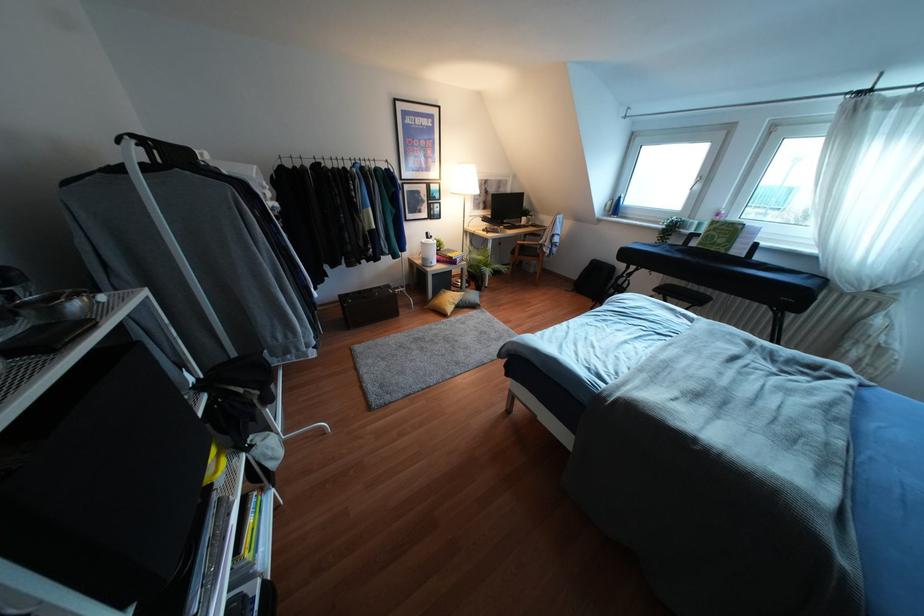
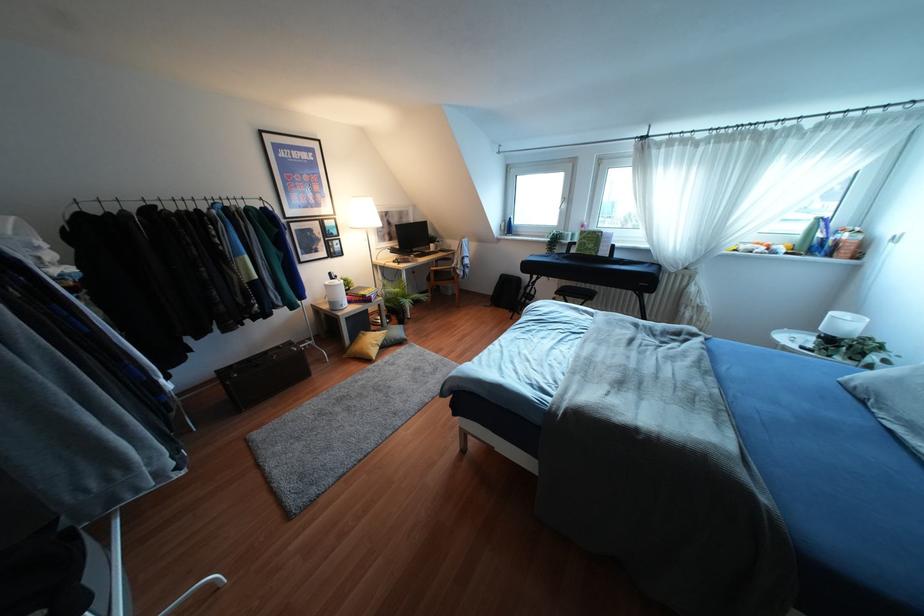
Question: The images are taken continuously from a first-person perspective. In which direction is your viewpoint rotating?

Choices:
 (A) Left
 (B) Right
 (C) Up
 (D) Down

Answer: (B)